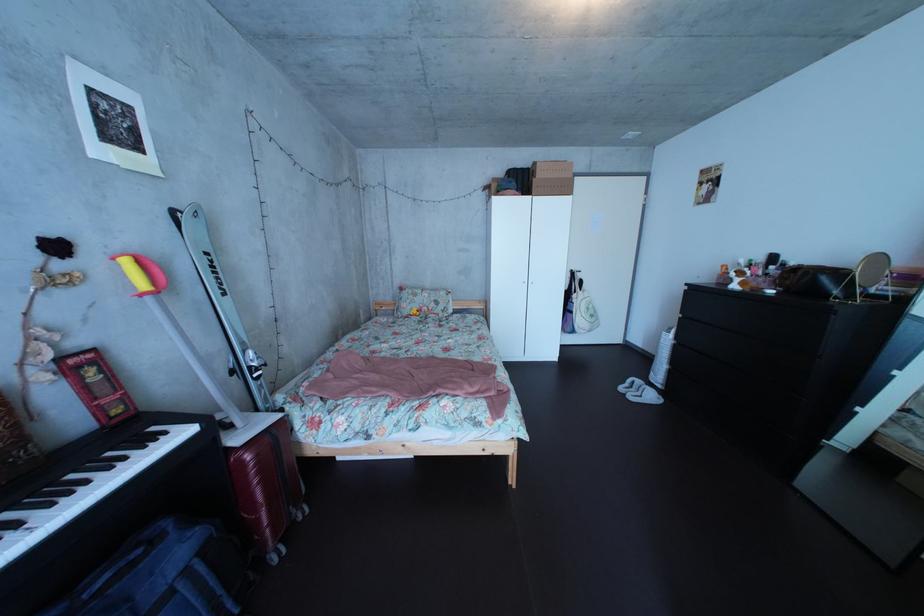
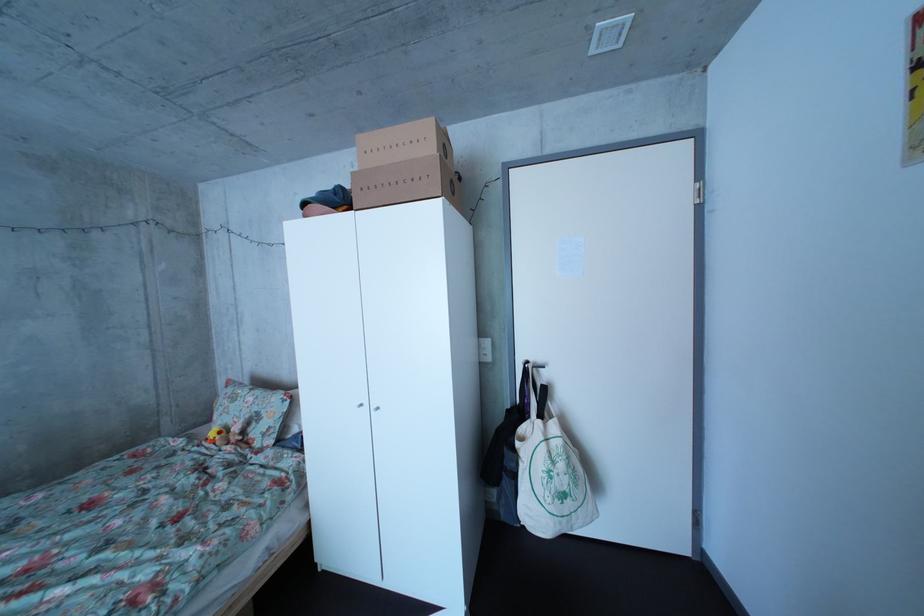
What movement of the cameraman would produce the second image?

The movement direction of the cameraman is right, forward.